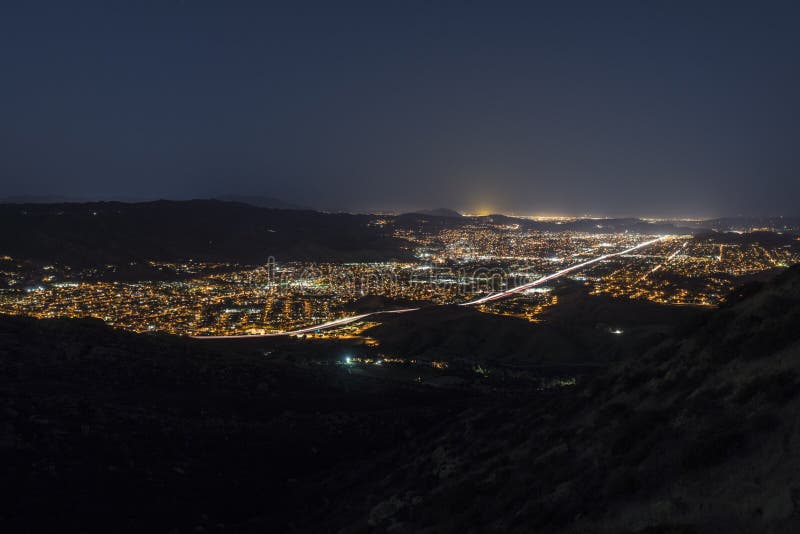
Locate an element on the screen. homes is located at coordinates (580, 245).